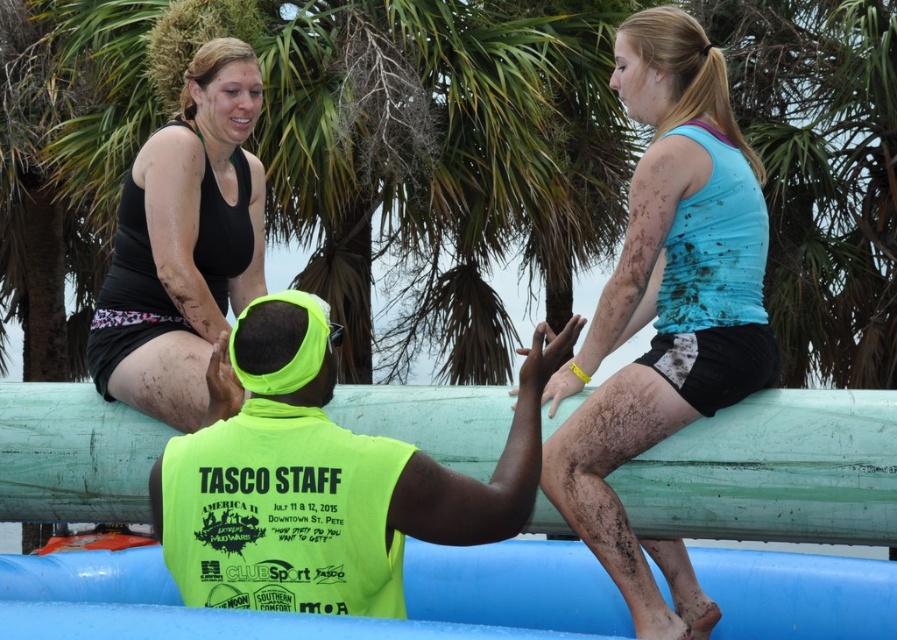
Question: Which point is farther to the camera?

Choices:
 (A) (242, 294)
 (B) (276, 586)

Answer: (A)

Question: Considering the relative positions of neon yellow vest at center and neon yellow fabric safety vest at center in the image provided, where is neon yellow vest at center located with respect to neon yellow fabric safety vest at center?

Choices:
 (A) left
 (B) right

Answer: (B)

Question: Does blue matte tank top at upper right have a larger size compared to neon yellow vest at center?

Choices:
 (A) no
 (B) yes

Answer: (B)

Question: Does blue matte tank top at upper right have a greater width compared to neon yellow vest at center?

Choices:
 (A) no
 (B) yes

Answer: (A)

Question: Estimate the real-world distances between objects in this image. Which object is closer to the neon yellow fabric safety vest at center?

Choices:
 (A) blue matte tank top at upper right
 (B) matte black tank top at upper left
 (C) neon yellow vest at center

Answer: (C)

Question: Which of the following is the closest to the observer?

Choices:
 (A) (242, 417)
 (B) (669, 144)

Answer: (A)